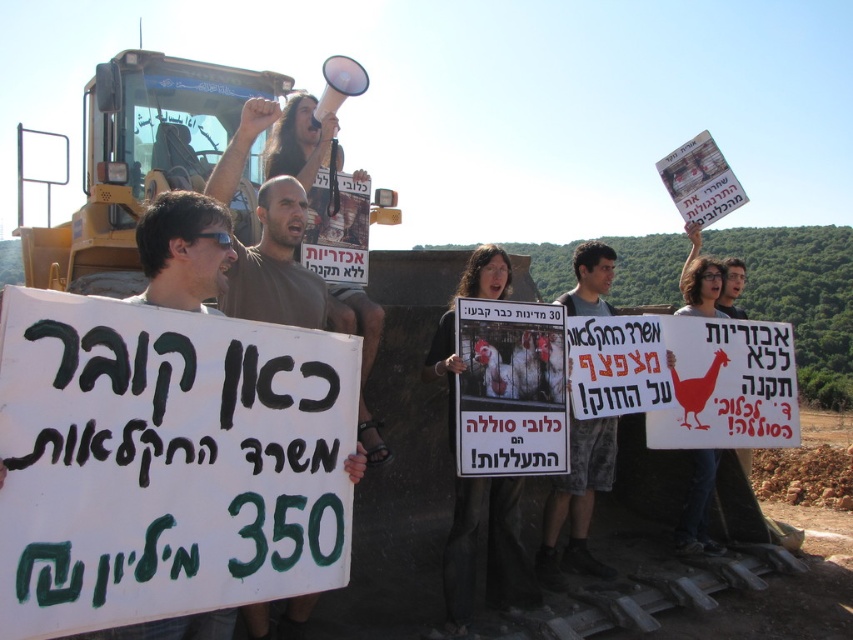
Who is taller, black fabric shirt at center or white paper sign at center?

black fabric shirt at center

Can you confirm if black fabric shirt at center is positioned to the right of white paper sign at center?

Correct, you'll find black fabric shirt at center to the right of white paper sign at center.

Who is more distant from viewer, (474, 492) or (183, 198)?

Positioned behind is point (474, 492).

Find the location of a particular element. Image resolution: width=853 pixels, height=640 pixels. black fabric shirt at center is located at coordinates (486, 554).

Between point (154, 205) and point (612, 314), which one is positioned behind?

The point (612, 314) is more distant.

Who is more forward, (175,300) or (573,522)?

Point (175,300) is more forward.

Image resolution: width=853 pixels, height=640 pixels. I want to click on white paper sign at center, so click(x=183, y=250).

Locate an element on the screen. The width and height of the screenshot is (853, 640). white paper sign at center is located at coordinates (183, 250).

Does white paper sign at center have a lesser width compared to white paper sign at upper right?

Indeed, white paper sign at center has a lesser width compared to white paper sign at upper right.

Which is behind, point (225, 237) or point (717, 314)?

Positioned behind is point (717, 314).

Identify the location of white paper sign at center. Image resolution: width=853 pixels, height=640 pixels. (183, 250).